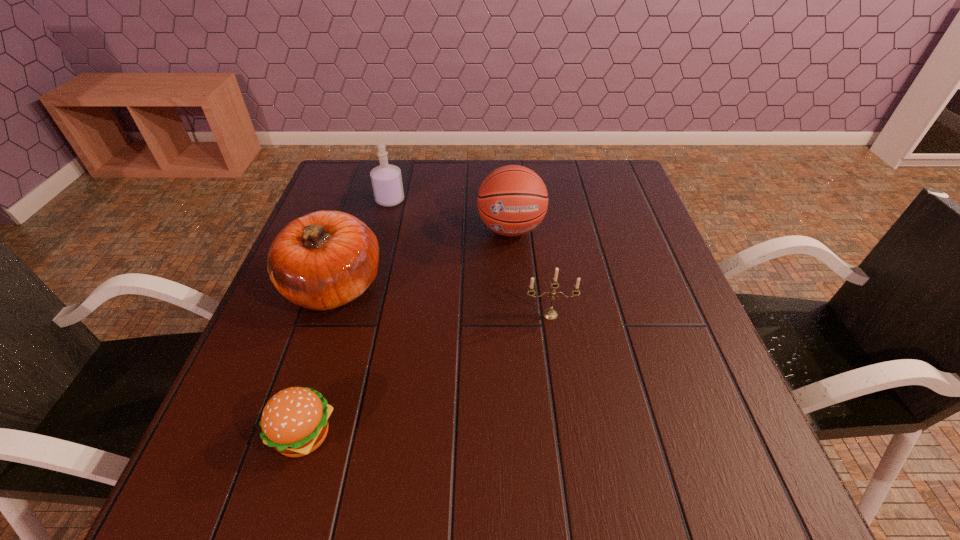
Locate an element on the screen. empty space that is in between the shortest object and the pumpkin is located at coordinates point(319,360).

Find the location of `unoccupied position between the hamburger and the perfume`. unoccupied position between the hamburger and the perfume is located at coordinates (348, 317).

The width and height of the screenshot is (960, 540). I want to click on vacant region between the basketball and the perfume, so click(x=450, y=214).

Identify which object is the third nearest to the shortest object. Please provide its 2D coordinates. Your answer should be formatted as a tuple, i.e. [(x, y)], where the tuple contains the x and y coordinates of a point satisfying the conditions above.

[(512, 200)]

Find the location of a particular element. object that is the second closest to the perfume is located at coordinates (512, 200).

Find the location of `vacant area in the image that satisfies the following two spatial constraints: 1. on the front side of the pumpkin; 2. on the left side of the fourth tallest object`. vacant area in the image that satisfies the following two spatial constraints: 1. on the front side of the pumpkin; 2. on the left side of the fourth tallest object is located at coordinates (324, 315).

Where is `free point that satisfies the following two spatial constraints: 1. on the logo side of the fourth nearest object; 2. on the right side of the candle`? This screenshot has height=540, width=960. free point that satisfies the following two spatial constraints: 1. on the logo side of the fourth nearest object; 2. on the right side of the candle is located at coordinates (518, 315).